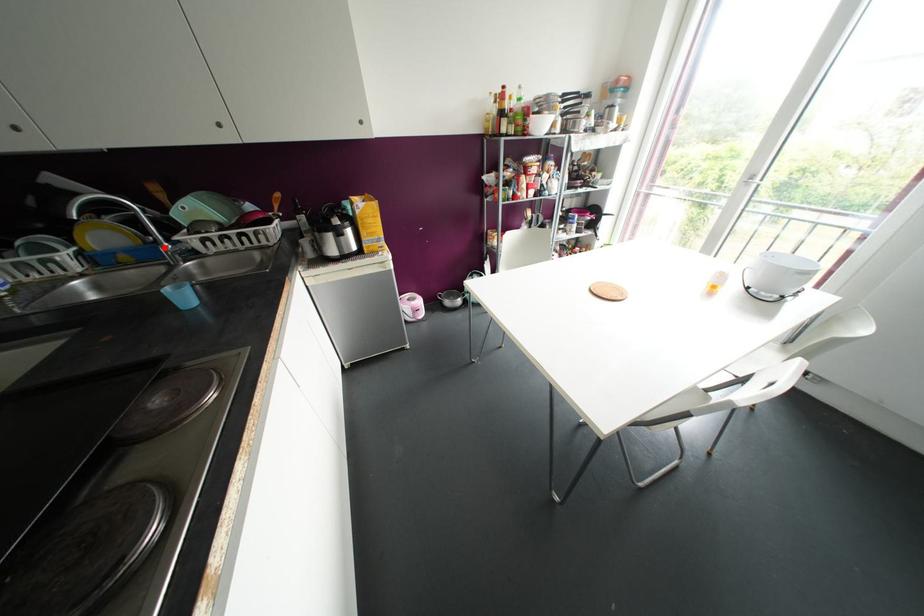
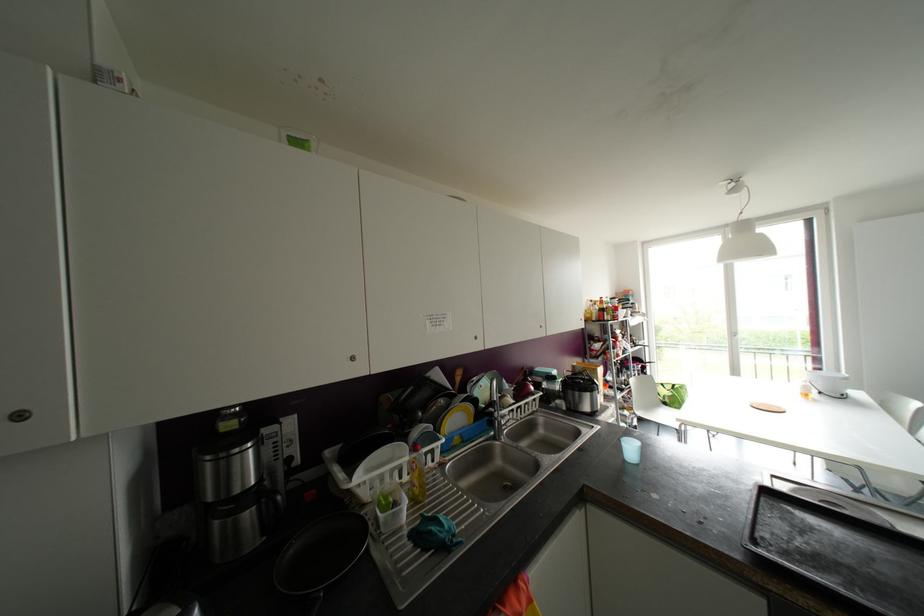
Locate, in the second image, the point that corresponds to the highlighted location in the first image.

(499, 422)